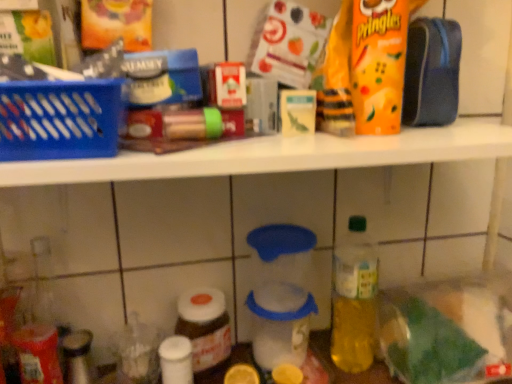
Question: In terms of height, does yellow matte lemon at lower center, arranged as the first lemon when viewed from the left, look taller or shorter compared to blue plastic basket at left?

Choices:
 (A) tall
 (B) short

Answer: (B)

Question: Considering the relative positions of yellow matte lemon at lower center, acting as the second lemon starting from the right, and blue plastic basket at left in the image provided, is yellow matte lemon at lower center, acting as the second lemon starting from the right, to the left or to the right of blue plastic basket at left?

Choices:
 (A) left
 (B) right

Answer: (B)

Question: Estimate the real-world distances between objects in this image. Which object is closer to the white plastic shelf at upper center?

Choices:
 (A) green plastic bottle at center-right, which appears as the 1th bottle when viewed from the right
 (B) translucent plastic container at lower left, arranged as the third bottle when viewed from the right
 (C) orange matte pringles at upper right
 (D) transparent plastic container at center
 (E) matte brown jar at lower left, which is counted as the 2th bottle, starting from the right

Answer: (C)

Question: Which of these objects is positioned closest to the transparent plastic container at center?

Choices:
 (A) yellow matte lemon at lower center, which is counted as the second lemon, starting from the left
 (B) white plastic shelf at upper center
 (C) translucent plastic container at lower left, arranged as the 1th bottle when viewed from the left
 (D) green plastic bag at lower right
 (E) matte brown jar at lower left, which is counted as the 2th bottle, starting from the right

Answer: (A)